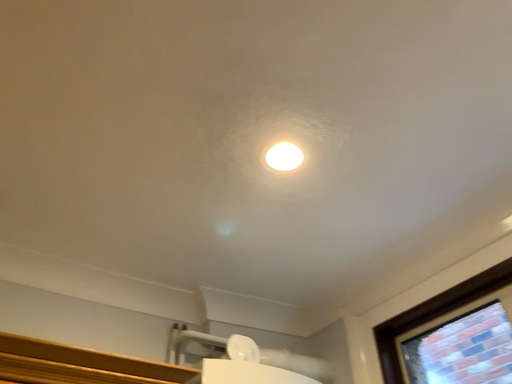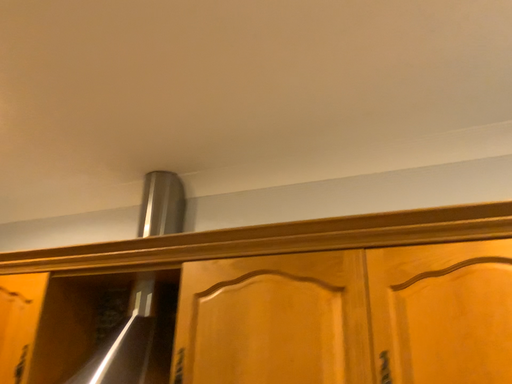
Question: Which way did the camera rotate in the video?

Choices:
 (A) rotated left
 (B) rotated right

Answer: (A)